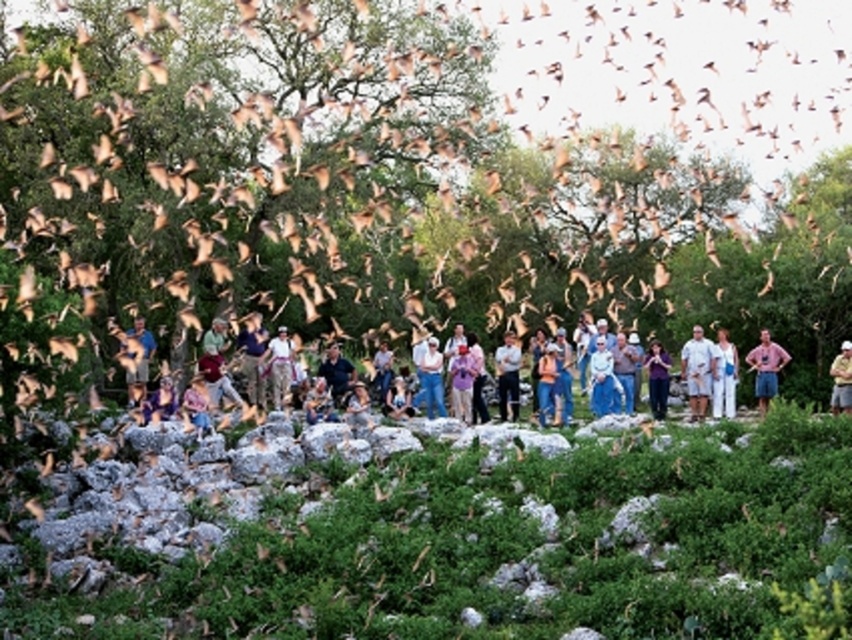
Question: Which of these objects is positioned closest to the white cotton shirt at center?

Choices:
 (A) pink cotton shirt at right
 (B) green leafy tree at center

Answer: (A)

Question: Does light blue shirt at center have a lesser width compared to white cotton shirt at center?

Choices:
 (A) no
 (B) yes

Answer: (A)

Question: Can you confirm if light blue shirt at center is positioned to the right of khaki cotton shirt at center?

Choices:
 (A) no
 (B) yes

Answer: (A)

Question: Considering the real-world distances, which object is closest to the green leafy tree at center?

Choices:
 (A) light blue shirt at center
 (B) khaki cotton shirt at center
 (C) white cotton shirt at center

Answer: (A)

Question: Which of the following is the closest to the observer?

Choices:
 (A) (686, 380)
 (B) (760, 349)

Answer: (B)

Question: Is green leafy tree at center closer to the viewer compared to pink cotton shirt at right?

Choices:
 (A) yes
 (B) no

Answer: (A)